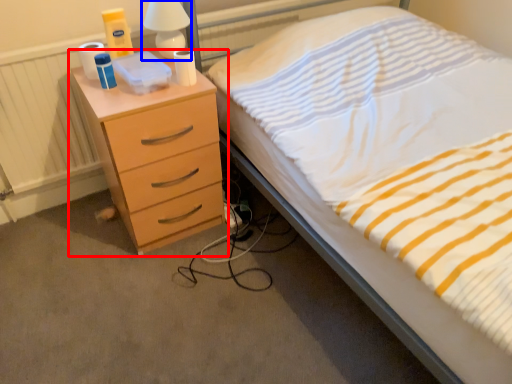
Question: Which object appears closest to the camera in this image, chest of drawers (highlighted by a red box) or bedside lamp (highlighted by a blue box)?

Choices:
 (A) chest of drawers
 (B) bedside lamp

Answer: (A)